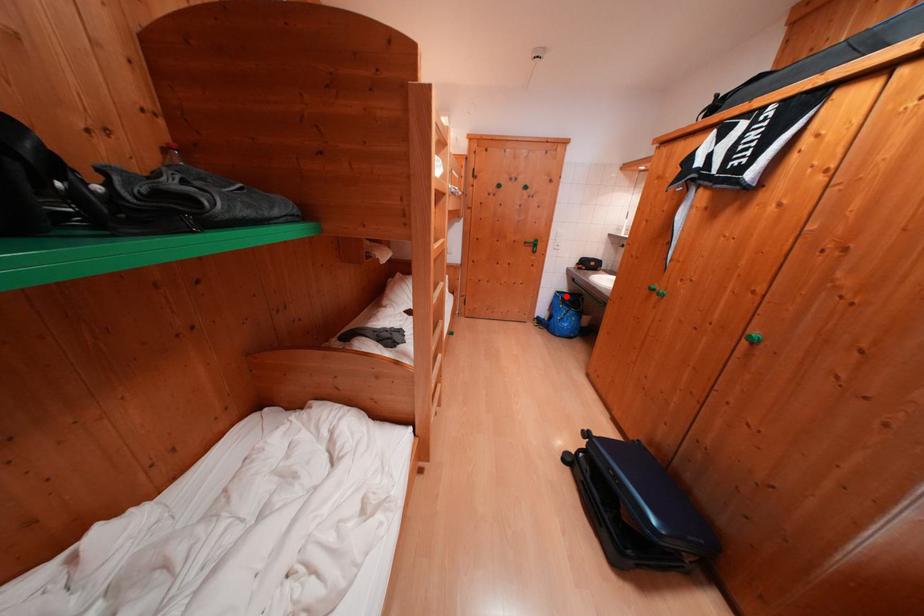
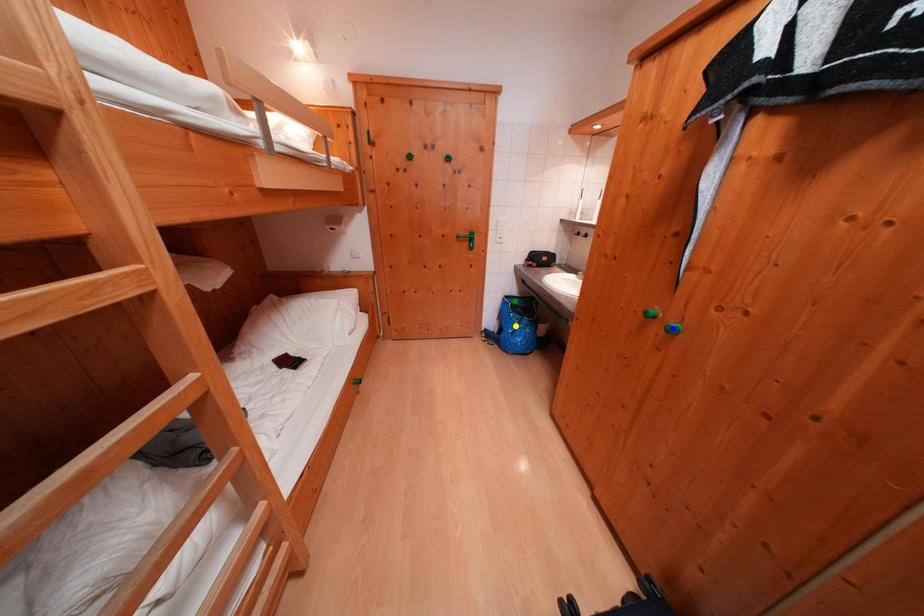
Question: I am providing you with two images of the same scene from different viewpoints. A red point is marked on the first image. You are given multiple points on the second image. Which spot in image 2 lines up with the point in image 1?

Choices:
 (A) green point
 (B) blue point
 (C) yellow point

Answer: (A)